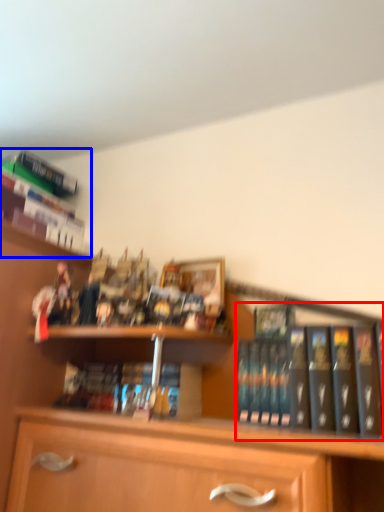
Question: Which object is closer to the camera taking this photo, book (highlighted by a red box) or book (highlighted by a blue box)?

Choices:
 (A) book
 (B) book

Answer: (A)